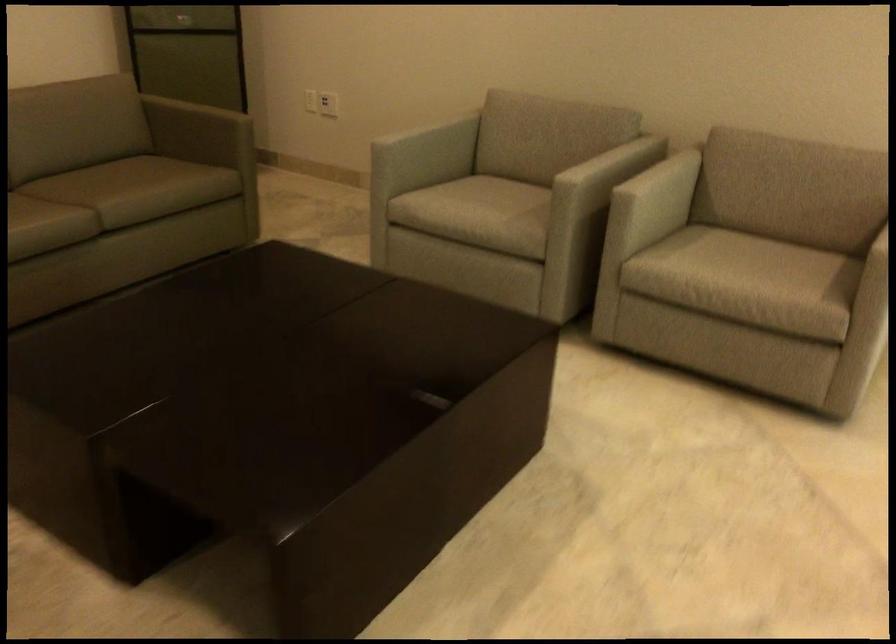
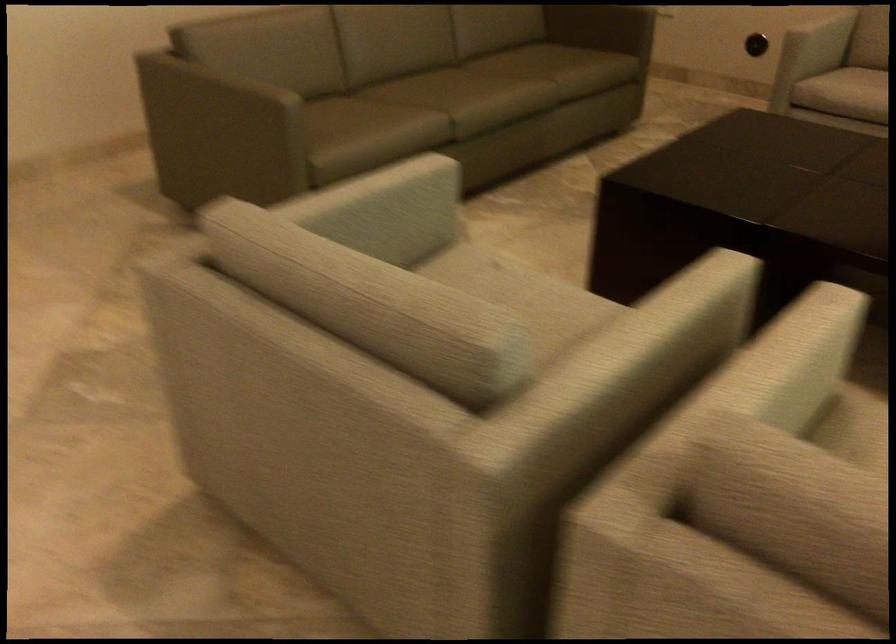
Locate, in the second image, the point that corresponds to [433,144] in the first image.

(821, 35)